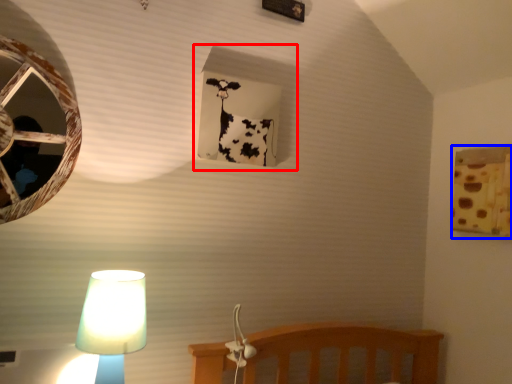
Question: Which object appears farthest to the camera in this image, window frame (highlighted by a red box) or window frame (highlighted by a blue box)?

Choices:
 (A) window frame
 (B) window frame

Answer: (B)